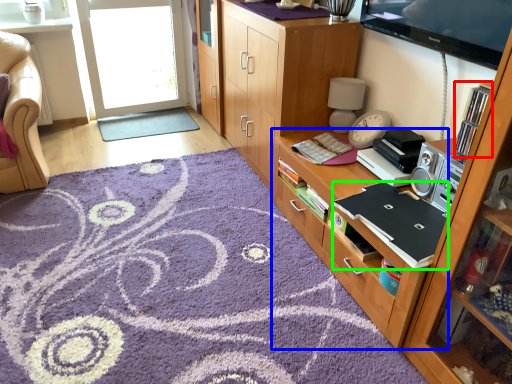
Question: Which object is positioned farthest from shelf (highlighted by a red box)? Select from cabinetry (highlighted by a blue box) and laptop (highlighted by a green box).

Choices:
 (A) cabinetry
 (B) laptop

Answer: (A)